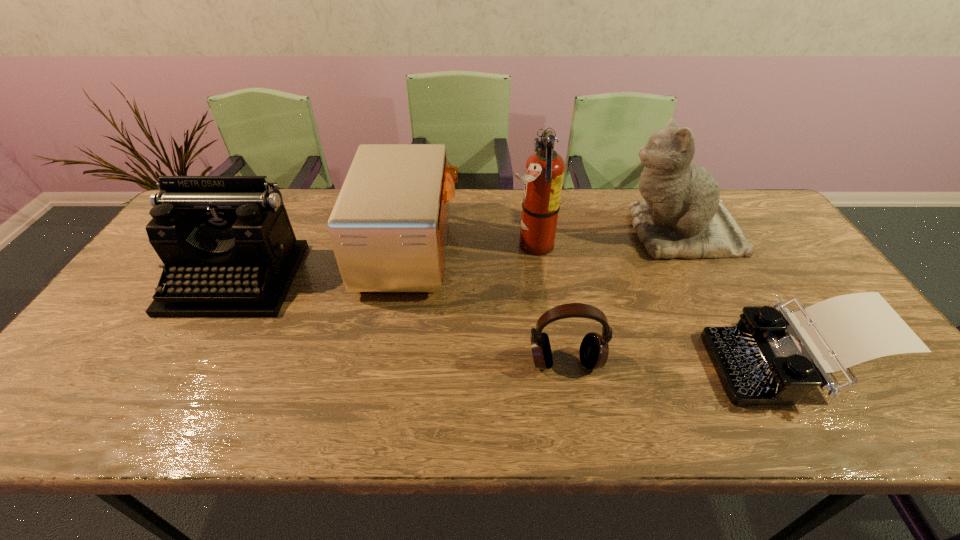
What are the coordinates of `free space at the near edge of the desktop` in the screenshot? It's located at (299, 397).

This screenshot has height=540, width=960. In the image, there is a desktop. What are the coordinates of `vacant space at the left edge` in the screenshot? It's located at (112, 353).

This screenshot has width=960, height=540. In order to click on free spot between the toaster oven and the nearer typewriter in this screenshot , I will do `click(597, 307)`.

Locate an element on the screen. free spot between the taller typewriter and the toaster oven is located at coordinates (324, 264).

Where is `empty space between the left typewriter and the headset`? This screenshot has height=540, width=960. empty space between the left typewriter and the headset is located at coordinates (400, 320).

Identify the location of vacant area that lies between the headset and the fifth object from right to left. The image size is (960, 540). (488, 306).

You are a GUI agent. You are given a task and a screenshot of the screen. Output one action in this format:
    pyautogui.click(x=<x>, y=<y>)
    Task: Click on the free area in between the taller typewriter and the toaster oven
    
    Given the screenshot: What is the action you would take?
    click(x=324, y=264)

This screenshot has height=540, width=960. In order to click on free spot between the cat and the leftmost object in this screenshot , I will do `click(457, 256)`.

This screenshot has width=960, height=540. I want to click on empty space between the right typewriter and the fire extinguisher, so click(x=658, y=305).

Where is `vacant space in between the headset and the shorter typewriter`? vacant space in between the headset and the shorter typewriter is located at coordinates (675, 363).